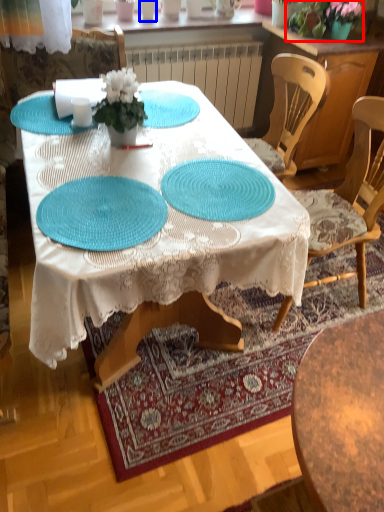
Question: Which object is further to the camera taking this photo, floral arrangement (highlighted by a red box) or tableware (highlighted by a blue box)?

Choices:
 (A) floral arrangement
 (B) tableware

Answer: (B)